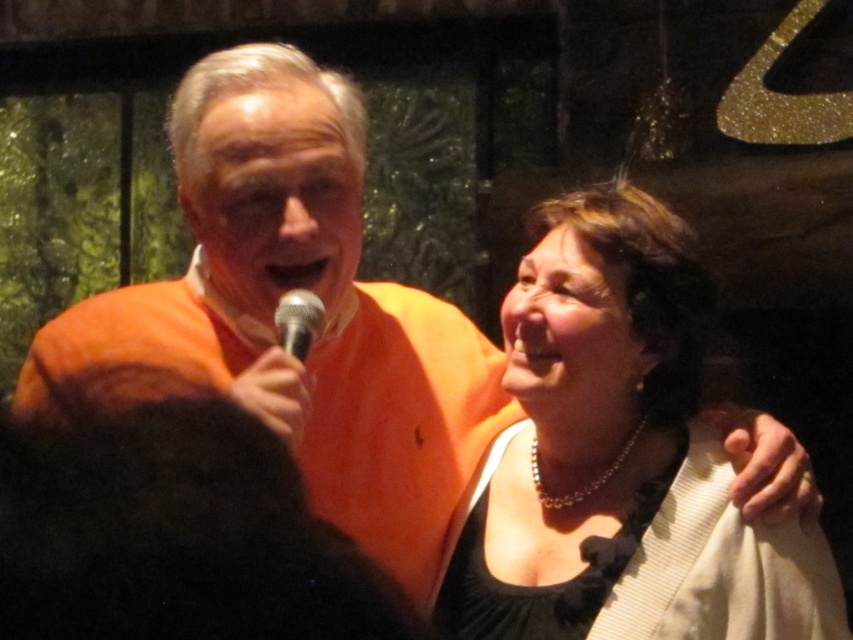
Is matte black dress at center shorter than silver metallic microphone at center?

In fact, matte black dress at center may be taller than silver metallic microphone at center.

The image size is (853, 640). What do you see at coordinates (619, 458) in the screenshot?
I see `matte black dress at center` at bounding box center [619, 458].

Is point (679, 577) closer to viewer compared to point (316, 333)?

Yes.

I want to click on matte black dress at center, so [619, 458].